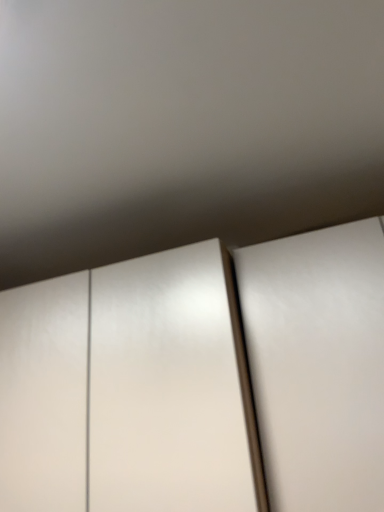
Question: From their relative heights in the image, would you say white glossy door at right is taller or shorter than white glossy cupboard at center?

Choices:
 (A) short
 (B) tall

Answer: (B)

Question: From the image's perspective, is white glossy door at right positioned above or below white glossy cupboard at center?

Choices:
 (A) below
 (B) above

Answer: (B)

Question: Looking at their shapes, would you say white glossy door at right is wider or thinner than white glossy cupboard at center?

Choices:
 (A) thin
 (B) wide

Answer: (B)

Question: From the image's perspective, is white glossy cupboard at center located above or below white glossy door at right?

Choices:
 (A) above
 (B) below

Answer: (B)

Question: From a real-world perspective, relative to white glossy door at right, is white glossy cupboard at center vertically above or below?

Choices:
 (A) above
 (B) below

Answer: (A)

Question: Would you say white glossy cupboard at center is to the left or to the right of white glossy door at right in the picture?

Choices:
 (A) right
 (B) left

Answer: (B)

Question: Do you think white glossy cupboard at center is within white glossy door at right, or outside of it?

Choices:
 (A) outside
 (B) inside

Answer: (A)